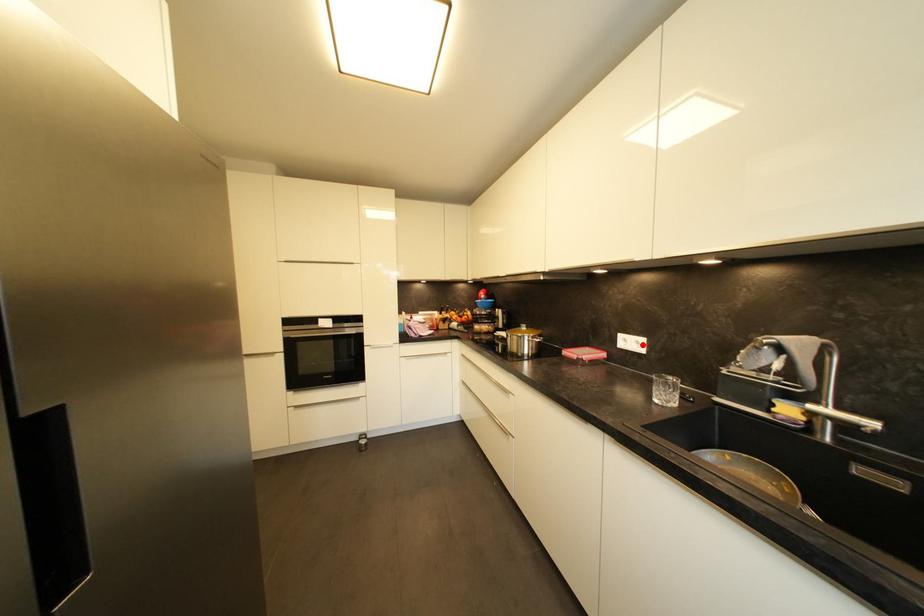
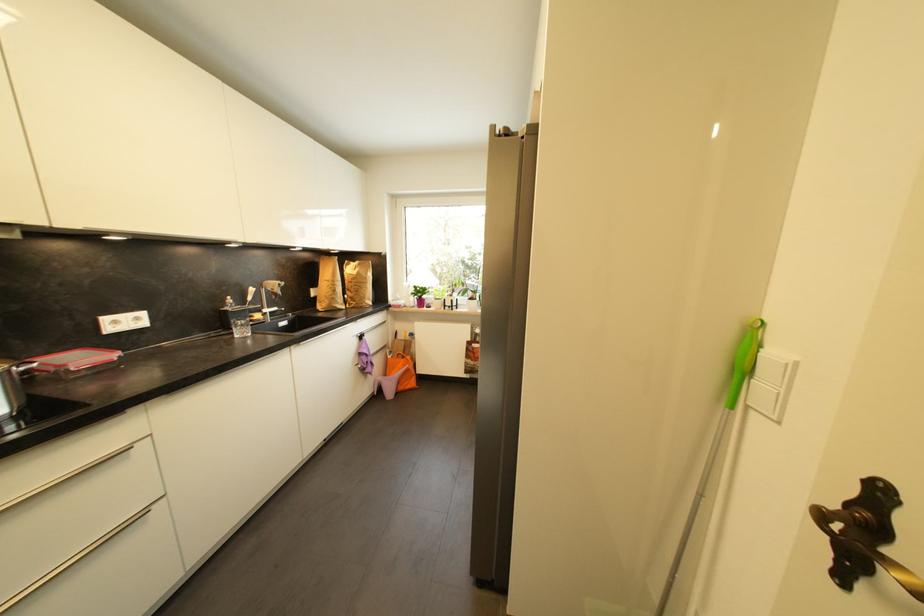
Find the pixel in the second image that matches the highlighted location in the first image.

(142, 321)